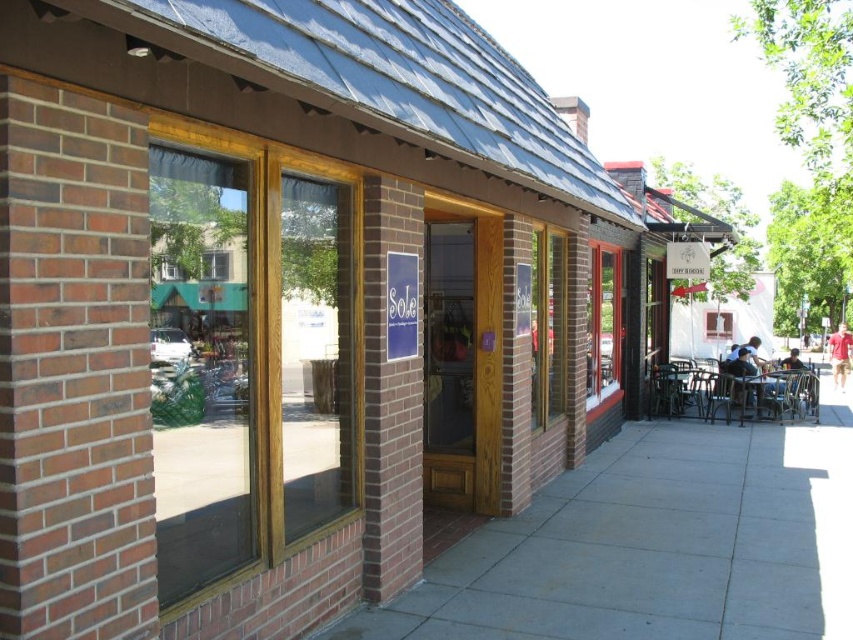
Question: Does gray concrete sidewalk at center have a smaller size compared to metallic silver table at lower right?

Choices:
 (A) yes
 (B) no

Answer: (B)

Question: Among these objects, which one is nearest to the camera?

Choices:
 (A) gray concrete sidewalk at center
 (B) clear glass window at center
 (C) metallic silver table at lower right

Answer: (B)

Question: Which point is closer to the camera?

Choices:
 (A) metallic silver table at lower right
 (B) gray concrete sidewalk at center

Answer: (B)

Question: Does clear glass window at center lie in front of metallic silver table at lower right?

Choices:
 (A) no
 (B) yes

Answer: (B)

Question: Does gray concrete sidewalk at center appear on the left side of metallic silver table at lower right?

Choices:
 (A) yes
 (B) no

Answer: (A)

Question: Estimate the real-world distances between objects in this image. Which object is closer to the gray concrete sidewalk at center?

Choices:
 (A) clear glass window at center
 (B) metallic silver table at lower right

Answer: (A)